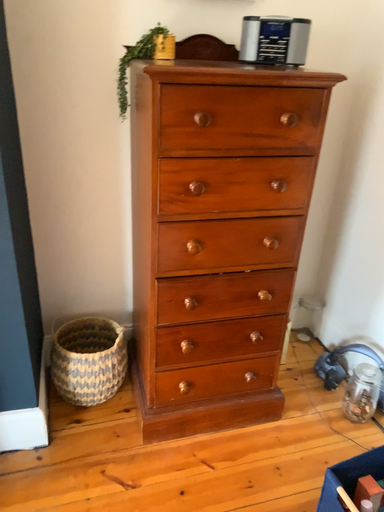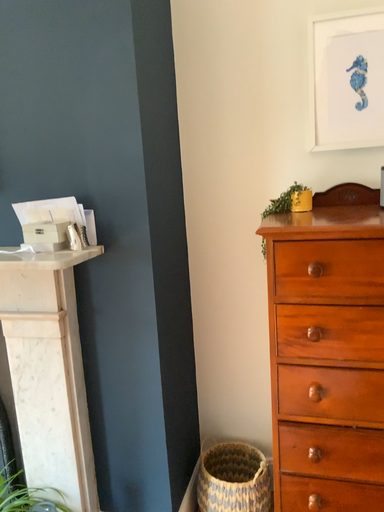
Question: Which way did the camera rotate in the video?

Choices:
 (A) rotated upward
 (B) rotated downward

Answer: (A)